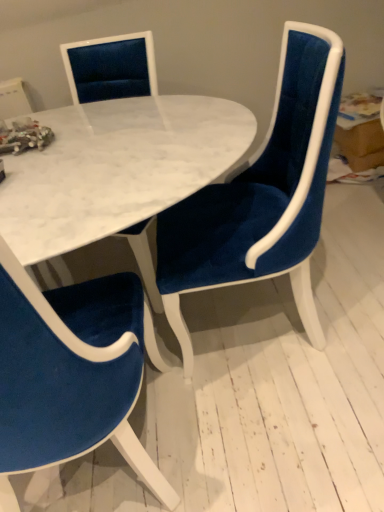
Question: From their relative heights in the image, would you say velvet blue chair at center, the 1th chair viewed from the right, is taller or shorter than white marble table at center?

Choices:
 (A) short
 (B) tall

Answer: (B)

Question: Considering the positions of velvet blue chair at center, the 1th chair viewed from the right, and white marble table at center in the image, is velvet blue chair at center, the 1th chair viewed from the right, wider or thinner than white marble table at center?

Choices:
 (A) wide
 (B) thin

Answer: (A)

Question: Which object is the farthest from the velvet blue chair at center, the 2th chair from the left?

Choices:
 (A) white marble table at center
 (B) velvet blue chair at lower left, positioned as the second chair in right-to-left order

Answer: (B)

Question: Which object is the farthest from the velvet blue chair at lower left, placed as the 1th chair when sorted from left to right?

Choices:
 (A) velvet blue chair at center, the 2th chair from the left
 (B) white marble table at center

Answer: (A)